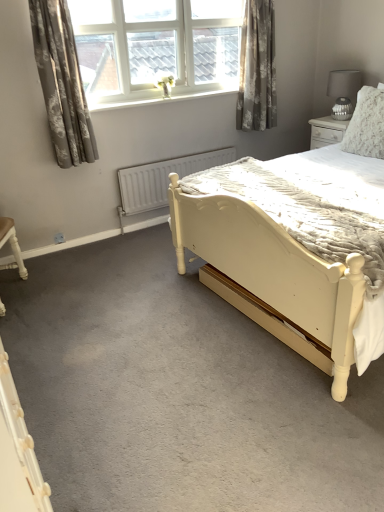
Question: From a real-world perspective, relative to matte gray lampshade at upper right, is white plastic window at upper center vertically above or below?

Choices:
 (A) below
 (B) above

Answer: (B)

Question: Considering their positions, is white plastic window at upper center located in front of or behind matte gray lampshade at upper right?

Choices:
 (A) front
 (B) behind

Answer: (A)

Question: Estimate the real-world distances between objects in this image. Which object is closer to the floral gray curtain at upper left, the 1th curtain when ordered from front to back?

Choices:
 (A) white matte radiator at center
 (B) matte gray lampshade at upper right
 (C) matte cream wooden bed at center
 (D) white plastic window at upper center
 (E) floral fabric curtain at upper right, placed as the 2th curtain when sorted from left to right

Answer: (D)

Question: Which object is positioned farthest from the white matte radiator at center?

Choices:
 (A) white plastic window at upper center
 (B) matte cream wooden bed at center
 (C) fluffy white pillow at upper right
 (D) matte gray lampshade at upper right
 (E) floral gray curtain at upper left, positioned as the second curtain in right-to-left order

Answer: (B)